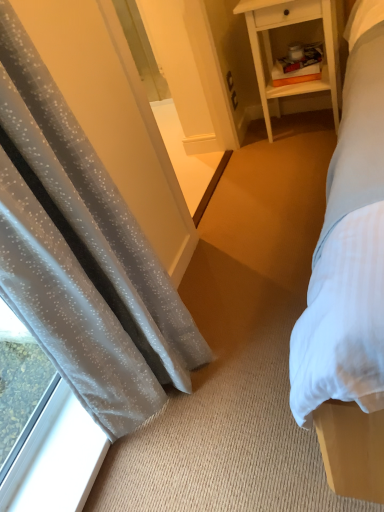
Locate an element on the screen. vacant area that is in front of translucent gray curtain at left is located at coordinates (210, 461).